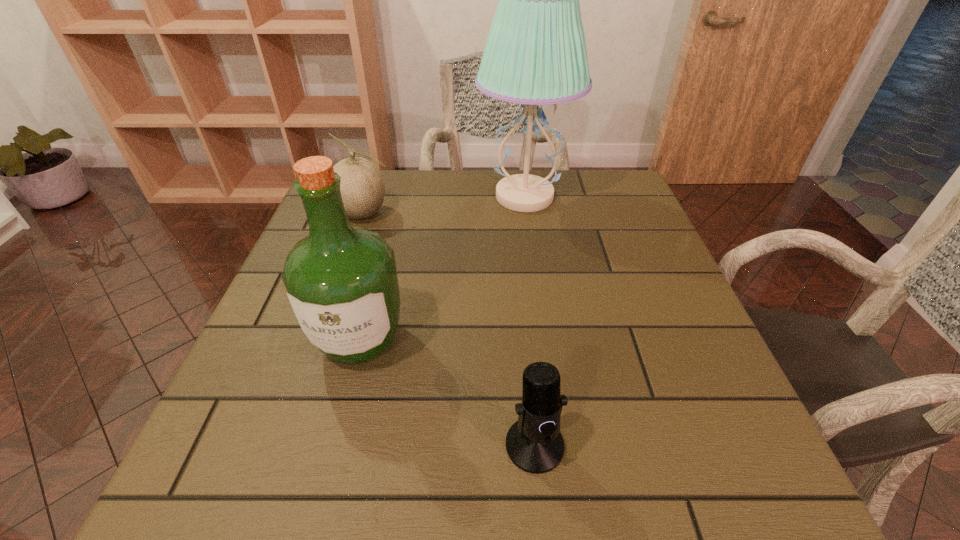
Identify the location of free space between the lamp and the microphone. Image resolution: width=960 pixels, height=540 pixels. (530, 321).

This screenshot has width=960, height=540. What are the coordinates of `empty space between the third shortest object and the nearest object` in the screenshot? It's located at (447, 392).

The image size is (960, 540). I want to click on free area in between the tallest object and the microphone, so click(x=530, y=321).

I want to click on vacant point located between the cantaloup and the microphone, so click(x=449, y=329).

Locate an element on the screen. The image size is (960, 540). free space between the nearest object and the tallest object is located at coordinates (530, 321).

Locate an element on the screen. This screenshot has height=540, width=960. empty location between the tallest object and the microphone is located at coordinates (530, 321).

This screenshot has height=540, width=960. What are the coordinates of `vacant point located between the liquor and the lamp` in the screenshot? It's located at (442, 268).

You are a GUI agent. You are given a task and a screenshot of the screen. Output one action in this format:
    pyautogui.click(x=<x>, y=<y>)
    Task: Click on the blank region between the lamp and the cantaloup
    The width and height of the screenshot is (960, 540).
    Given the screenshot: What is the action you would take?
    pyautogui.click(x=444, y=205)

You are a GUI agent. You are given a task and a screenshot of the screen. Output one action in this format:
    pyautogui.click(x=<x>, y=<y>)
    Task: Click on the empty space that is in between the nearest object and the cantaloup
    
    Given the screenshot: What is the action you would take?
    pyautogui.click(x=449, y=329)

The image size is (960, 540). What are the coordinates of `vacant space in between the lamp and the microphone` in the screenshot? It's located at (530, 321).